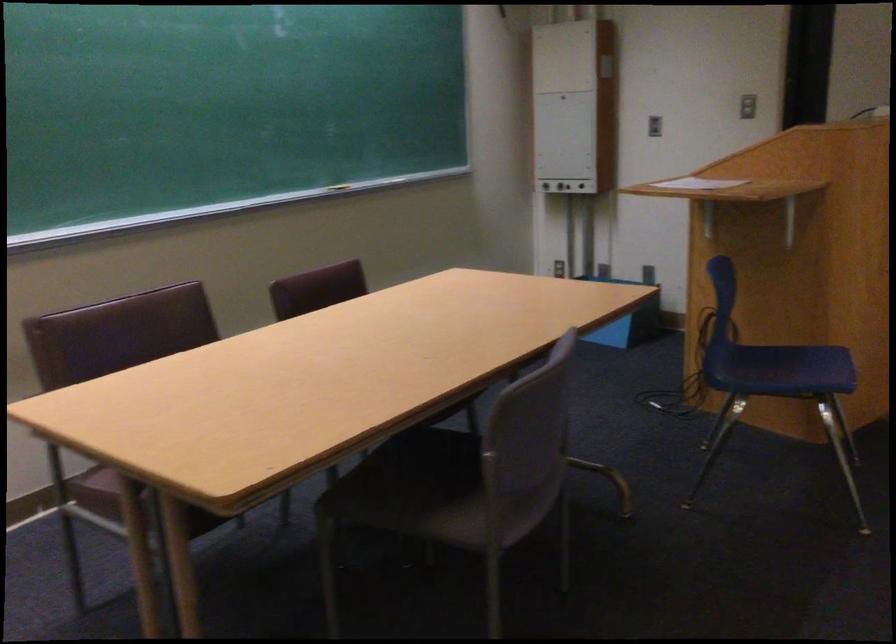
Find where to sit the brown chair sitting surface. Please return your answer as a coordinate pair (x, y).

(96, 491)